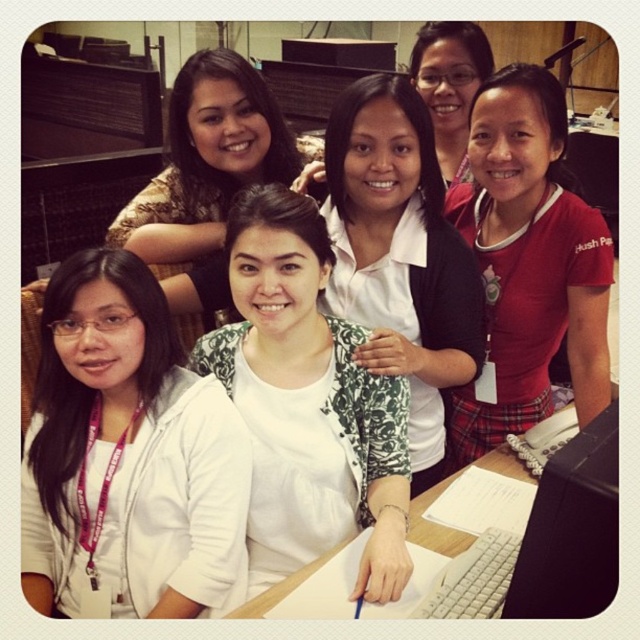
Can you confirm if white matte jacket at lower left is smaller than wooden desk at lower center?

Incorrect, white matte jacket at lower left is not smaller in size than wooden desk at lower center.

Which of these two, white matte jacket at lower left or wooden desk at lower center, stands taller?

white matte jacket at lower left is taller.

Describe the element at coordinates (131, 451) in the screenshot. I see `white matte jacket at lower left` at that location.

In order to click on white matte jacket at lower left in this screenshot , I will do `click(131, 451)`.

Can you confirm if black plastic monitor at lower right is taller than wooden desk at lower center?

Yes, black plastic monitor at lower right is taller than wooden desk at lower center.

Based on the photo, who is positioned more to the left, black plastic monitor at lower right or wooden desk at lower center?

Positioned to the left is wooden desk at lower center.

Where is `black plastic monitor at lower right`? black plastic monitor at lower right is located at coordinates pos(572,529).

The image size is (640, 640). I want to click on black plastic monitor at lower right, so click(572, 529).

Who is positioned more to the right, white fabric shirt at center or red matte shirt at upper right?

red matte shirt at upper right

Can you confirm if white fabric shirt at center is smaller than red matte shirt at upper right?

Yes.

Image resolution: width=640 pixels, height=640 pixels. What do you see at coordinates (308, 401) in the screenshot?
I see `white fabric shirt at center` at bounding box center [308, 401].

Where is `white fabric shirt at center`? This screenshot has width=640, height=640. white fabric shirt at center is located at coordinates (308, 401).